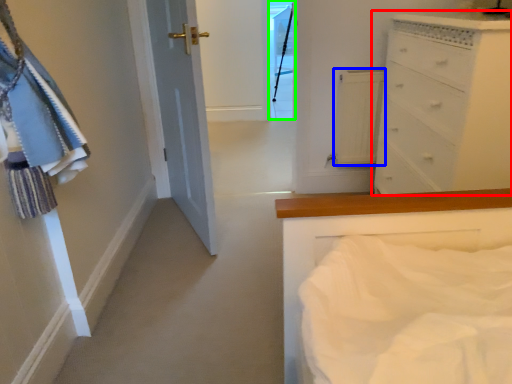
Question: Estimate the real-world distances between objects in this image. Which object is closer to chest of drawers (highlighted by a red box), cabinetry (highlighted by a blue box) or glass door (highlighted by a green box)?

Choices:
 (A) cabinetry
 (B) glass door

Answer: (A)